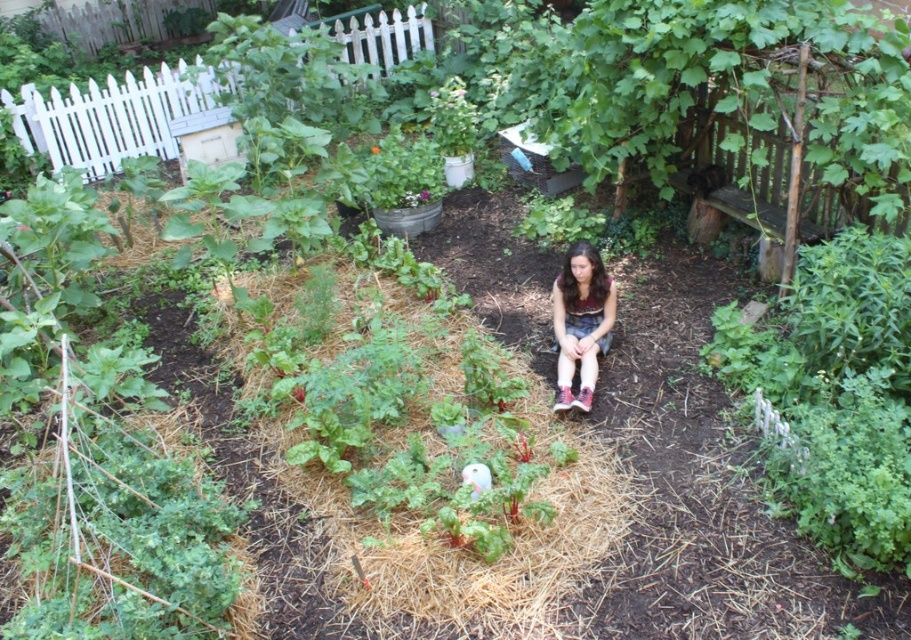
Question: Which object appears closest to the camera in this image?

Choices:
 (A) wooden planter at center
 (B) matte brown shorts at center
 (C) brown straw at center

Answer: (C)

Question: Among these objects, which one is nearest to the camera?

Choices:
 (A) brown straw at center
 (B) matte brown shorts at center

Answer: (A)

Question: Can you confirm if brown straw at center is positioned to the right of matte brown shorts at center?

Choices:
 (A) yes
 (B) no

Answer: (B)

Question: Which object appears farthest from the camera in this image?

Choices:
 (A) matte brown shorts at center
 (B) brown straw at center

Answer: (A)

Question: Does brown straw at center lie in front of matte brown shorts at center?

Choices:
 (A) no
 (B) yes

Answer: (B)

Question: Is brown straw at center positioned before matte brown shorts at center?

Choices:
 (A) yes
 (B) no

Answer: (A)